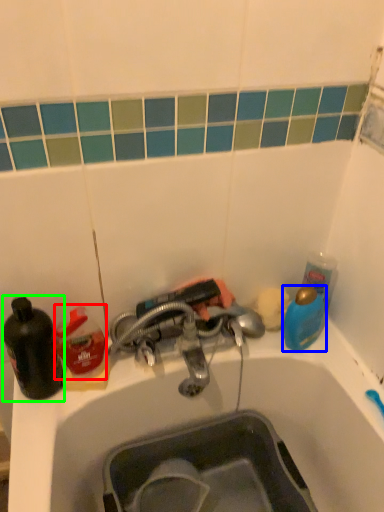
Question: Estimate the real-world distances between objects in this image. Which object is closer to cleaning product (highlighted by a red box), teal (highlighted by a blue box) or bottle (highlighted by a green box)?

Choices:
 (A) teal
 (B) bottle

Answer: (B)